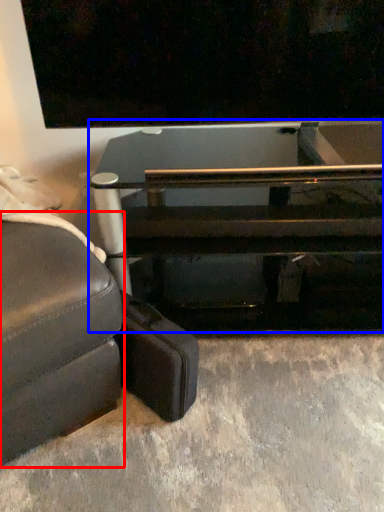
Question: Which object appears farthest to the camera in this image, studio couch (highlighted by a red box) or table (highlighted by a blue box)?

Choices:
 (A) studio couch
 (B) table

Answer: (B)